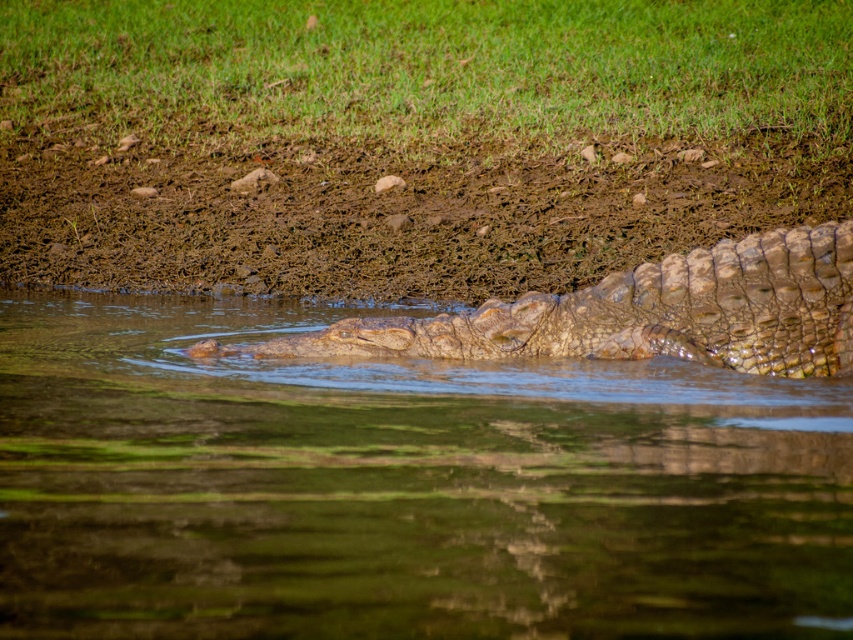
Question: Can you confirm if brown textured mud at center is positioned to the right of leathery brown crocodile at center?

Choices:
 (A) yes
 (B) no

Answer: (B)

Question: Does brown textured mud at center have a lesser width compared to leathery brown crocodile at center?

Choices:
 (A) yes
 (B) no

Answer: (B)

Question: Which object appears closest to the camera in this image?

Choices:
 (A) brown textured mud at center
 (B) leathery brown crocodile at center

Answer: (B)

Question: Among these points, which one is farthest from the camera?

Choices:
 (A) (178, 365)
 (B) (202, 179)

Answer: (B)

Question: Based on their relative distances, which object is nearer to the greenish water at center?

Choices:
 (A) brown textured mud at center
 (B) leathery brown crocodile at center

Answer: (B)

Question: Observing the image, what is the correct spatial positioning of greenish water at center in reference to brown textured mud at center?

Choices:
 (A) below
 (B) above

Answer: (A)